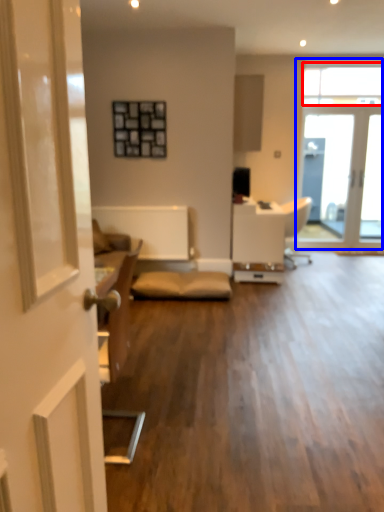
Question: Which point is further to the camera, window (highlighted by a red box) or window (highlighted by a blue box)?

Choices:
 (A) window
 (B) window

Answer: (B)